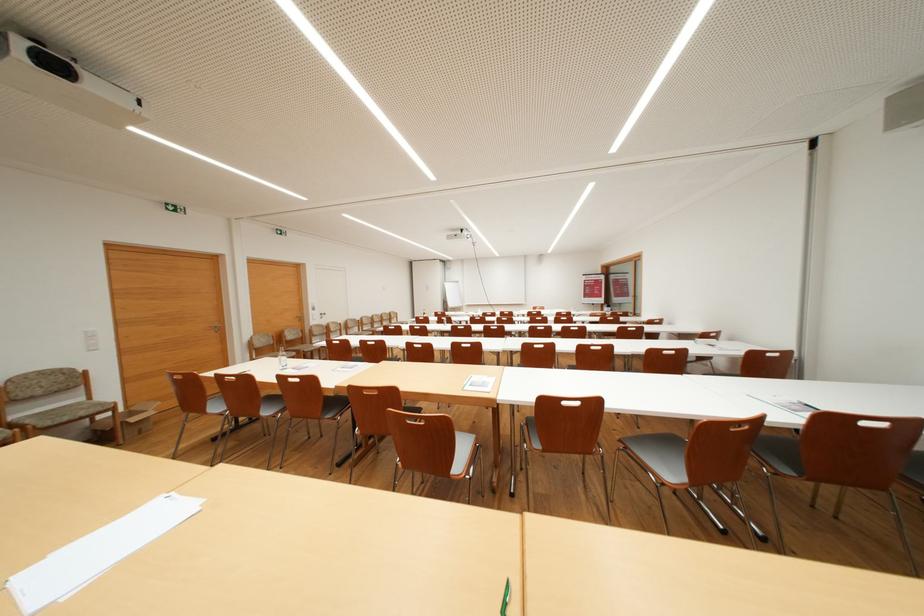
Locate an element on the screen. The image size is (924, 616). patterned chair sitting surface is located at coordinates (433, 448).